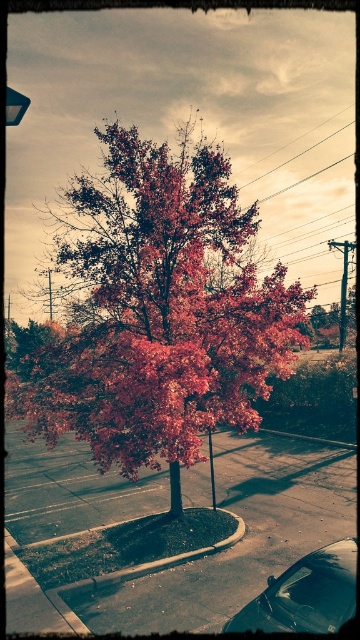
You are a photographer standing in front of the shiny red maple tree at center and the shiny black car at lower right. You want to take a photo that includes both objects but focuses on the tree. Which object should you move closer to the camera to achieve this?

To focus on the shiny red maple tree at center while including the shiny black car at lower right, you should move closer to the camera the shiny red maple tree at center since it is already closer to the viewer than the car.

You are a photographer trying to capture a photo of the shiny red maple tree at center without the shiny black car at lower right appearing in the frame. Based on their positions, is it possible to position yourself so that the car is out of the shot?

Yes, since the shiny red maple tree at center is to the left of the shiny black car at lower right, you can move to the left side of the scene to position yourself so that the car is out of the frame.